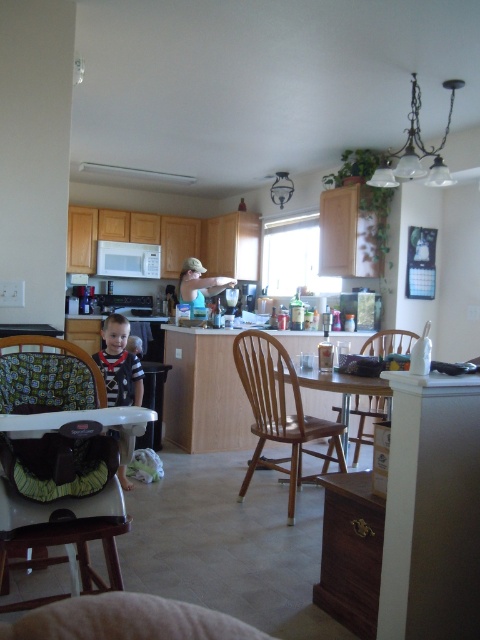
Question: Which point appears closest to the camera in this image?

Choices:
 (A) (130, 388)
 (B) (9, 502)

Answer: (B)

Question: Which point is farther to the camera?

Choices:
 (A) (84, 378)
 (B) (363, 380)
 (C) (294, 400)
 (D) (100, 365)

Answer: (C)

Question: Can you confirm if brown wood chair at center is bigger than wooden chair at center?

Choices:
 (A) no
 (B) yes

Answer: (B)

Question: Considering the relative positions of striped fabric high chair at left and wooden table at center in the image provided, where is striped fabric high chair at left located with respect to wooden table at center?

Choices:
 (A) above
 (B) below

Answer: (A)

Question: Can you confirm if green fabric highchair at lower left is smaller than brown wood chair at center?

Choices:
 (A) no
 (B) yes

Answer: (B)

Question: Which object is the farthest from the brown wood chair at center?

Choices:
 (A) wooden chair at center
 (B) green fabric highchair at lower left
 (C) striped fabric high chair at left

Answer: (B)